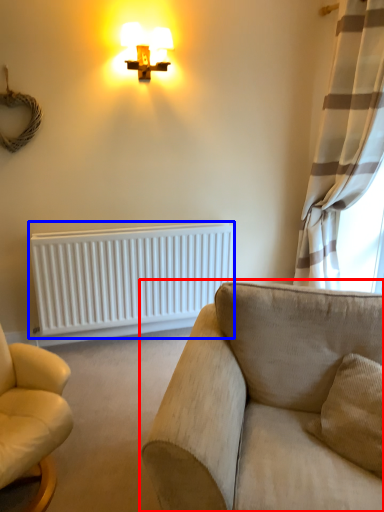
Question: Among these objects, which one is nearest to the camera, studio couch (highlighted by a red box) or radiator (highlighted by a blue box)?

Choices:
 (A) studio couch
 (B) radiator

Answer: (A)